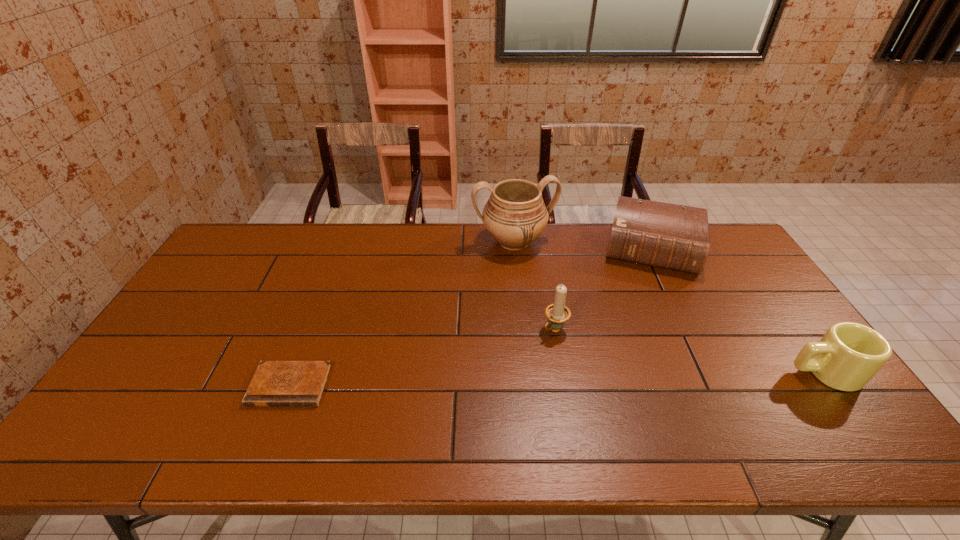
The image size is (960, 540). What are the coordinates of `free space between the leftmost object and the rightmost object` in the screenshot? It's located at (557, 379).

Locate an element on the screen. The image size is (960, 540). vacant area that lies between the second object from right to left and the mug is located at coordinates (738, 311).

Choose which object is the fourth nearest neighbor to the mug. Please provide its 2D coordinates. Your answer should be formatted as a tuple, i.e. [(x, y)], where the tuple contains the x and y coordinates of a point satisfying the conditions above.

[(275, 383)]

Choose which object is the fourth nearest neighbor to the urn. Please provide its 2D coordinates. Your answer should be formatted as a tuple, i.e. [(x, y)], where the tuple contains the x and y coordinates of a point satisfying the conditions above.

[(849, 354)]

This screenshot has height=540, width=960. Find the location of `vacant space that satisfies the following two spatial constraints: 1. on the front side of the rightmost object; 2. with the handle on the side of the Bible`. vacant space that satisfies the following two spatial constraints: 1. on the front side of the rightmost object; 2. with the handle on the side of the Bible is located at coordinates (711, 372).

Where is `vacant space that satisfies the following two spatial constraints: 1. on the front side of the third nearest object; 2. on the right side of the urn`? The height and width of the screenshot is (540, 960). vacant space that satisfies the following two spatial constraints: 1. on the front side of the third nearest object; 2. on the right side of the urn is located at coordinates (522, 329).

The image size is (960, 540). Find the location of `free spot that satisfies the following two spatial constraints: 1. on the front side of the urn; 2. with the handle on the side of the mug`. free spot that satisfies the following two spatial constraints: 1. on the front side of the urn; 2. with the handle on the side of the mug is located at coordinates (526, 372).